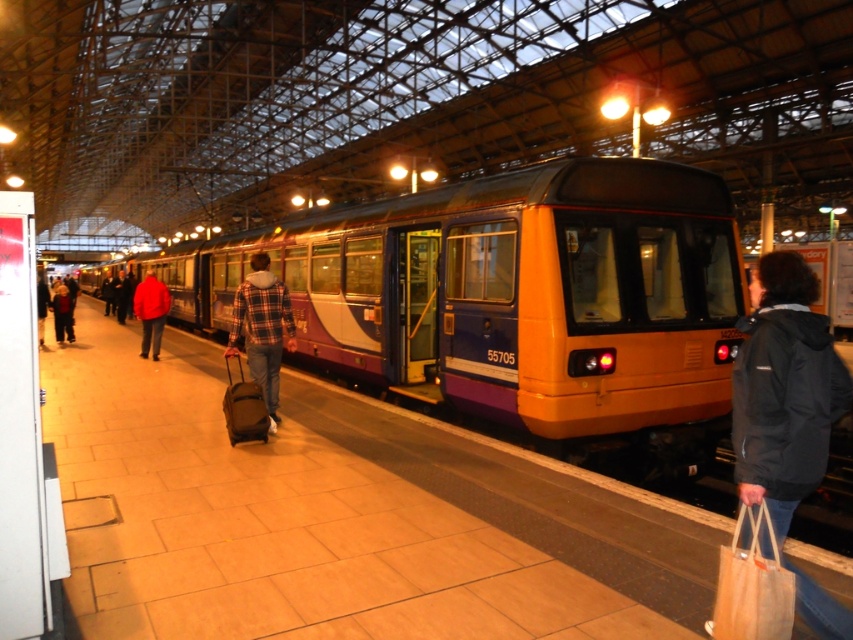
In the scene shown: Between metallic purple train at center and red jacket at left, which one is positioned higher?

metallic purple train at center is above.

Is point (654, 433) positioned after point (148, 340)?

No, it is in front of (148, 340).

The width and height of the screenshot is (853, 640). Describe the element at coordinates (514, 298) in the screenshot. I see `metallic purple train at center` at that location.

The width and height of the screenshot is (853, 640). Identify the location of metallic purple train at center. (514, 298).

Can you confirm if dark gray jacket at right is thinner than red jacket at left?

Yes.

Can you confirm if dark gray jacket at right is positioned to the left of red jacket at left?

Incorrect, dark gray jacket at right is not on the left side of red jacket at left.

You are a GUI agent. You are given a task and a screenshot of the screen. Output one action in this format:
    pyautogui.click(x=<x>, y=<y>)
    Task: Click on the dark gray jacket at right
    The height and width of the screenshot is (640, 853).
    Given the screenshot: What is the action you would take?
    pyautogui.click(x=784, y=390)

This screenshot has height=640, width=853. Find the location of `dark gray jacket at right`. dark gray jacket at right is located at coordinates (784, 390).

Who is more forward, [283,314] or [152,285]?

Point [283,314] is more forward.

Does plaid fabric jacket at center have a greater width compared to red jacket at left?

No.

Who is more distant from viewer, (265, 284) or (157, 285)?

The point (157, 285) is more distant.

At what (x,y) coordinates should I click in order to perform the action: click on plaid fabric jacket at center. Please return your answer as a coordinate pair (x, y). Looking at the image, I should click on (262, 328).